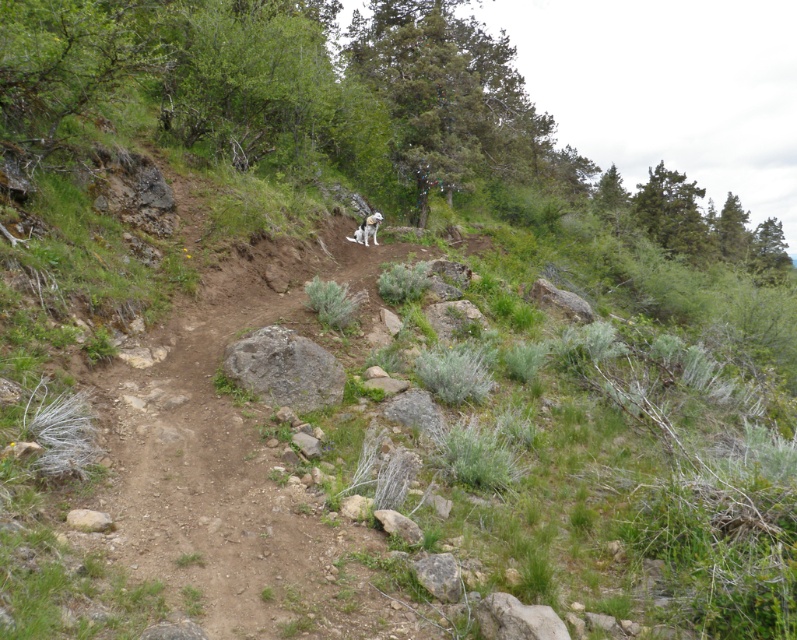
Consider the image. You are a hiker walking along the dirt trail and you see a gray rough rock at center and a white fur dog at center. Which object is taller?

The gray rough rock at center is not as tall as the white fur dog at center, so the white fur dog at center is taller.

You are standing at the camera position and want to reach point (x=214, y=536). Is the distance less than 6 meters?

The distance between point (x=214, y=536) and the camera is 5.76 meters, so yes, it is less than 6 meters.

You are a hiker planning to walk along the trail. You have a map showing the dull brown dirt track at center and the gray rough rock at center. Which one has a smaller width?

The dull brown dirt track at center is thinner than the gray rough rock at center, so the dull brown dirt track at center has a smaller width.